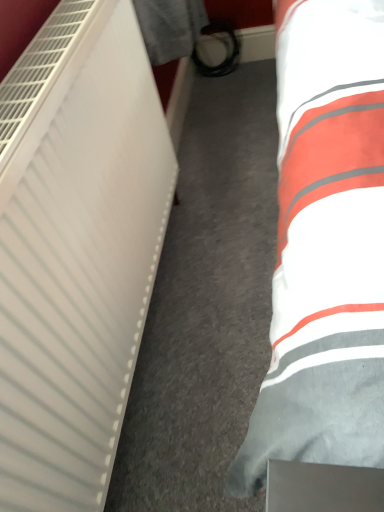
The image size is (384, 512). I want to click on white matte radiator at left, so click(76, 248).

What do you see at coordinates (76, 248) in the screenshot? I see `white matte radiator at left` at bounding box center [76, 248].

What is the approximate height of white matte radiator at left?

white matte radiator at left is 31.51 inches in height.

The image size is (384, 512). What are the coordinates of `white matte radiator at left` in the screenshot? It's located at (76, 248).